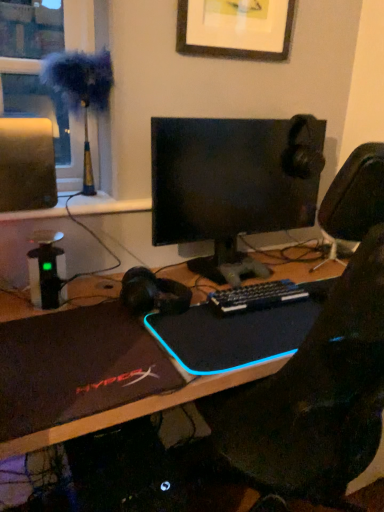
Describe the element at coordinates (118, 467) in the screenshot. I see `black matte desk at center` at that location.

Where is `wooden picture frame at upper center`? wooden picture frame at upper center is located at coordinates (236, 28).

Describe the element at coordinates (233, 184) in the screenshot. I see `black glossy monitor at center` at that location.

The width and height of the screenshot is (384, 512). What do you see at coordinates (257, 296) in the screenshot? I see `black plastic keyboard at center` at bounding box center [257, 296].

You are a GUI agent. You are given a task and a screenshot of the screen. Output one action in this format:
    pyautogui.click(x=<x>, y=<y>)
    Task: Click on the black matte desk at center
    The width and height of the screenshot is (384, 512).
    Given the screenshot: What is the action you would take?
    pyautogui.click(x=118, y=467)

Is the surface of black matte desk at center in direct contact with black plastic keyboard at center?

black matte desk at center and black plastic keyboard at center are not in contact.

Considering the relative sizes of black matte desk at center and black plastic keyboard at center in the image provided, is black matte desk at center wider than black plastic keyboard at center?

Yes.

Consider the image. Is black matte desk at center oriented away from black plastic keyboard at center?

No, black plastic keyboard at center is not at the back of black matte desk at center.

In the scene shown: Measure the distance between black matte desk at center and black plastic keyboard at center.

77.94 centimeters.

Does point (207, 1) appear closer or farther from the camera than point (291, 141)?

Clearly, point (207, 1) is closer to the camera than point (291, 141).

Which is behind, wooden picture frame at upper center or black glossy monitor at center?

wooden picture frame at upper center is more distant.

Consider the image. Is wooden picture frame at upper center facing away from black glossy monitor at center?

No, wooden picture frame at upper center is not facing away from black glossy monitor at center.

Would you say wooden picture frame at upper center is to the left or to the right of black glossy monitor at center in the picture?

Based on their positions, wooden picture frame at upper center is located to the right of black glossy monitor at center.

Is black glossy monitor at center situated inside black matte desk at center or outside?

black glossy monitor at center is not enclosed by black matte desk at center.

The width and height of the screenshot is (384, 512). In the image, there is a black matte desk at center. In order to click on computer monitor above it (from the image's perspective) in this screenshot , I will do `click(233, 184)`.

Is point (255, 169) closer or farther from the camera than point (181, 503)?

Point (255, 169) is farther from the camera than point (181, 503).

Considering the relative positions of black glossy monitor at center and black matte desk at center in the image provided, is black glossy monitor at center to the right of black matte desk at center from the viewer's perspective?

Correct, you'll find black glossy monitor at center to the right of black matte desk at center.

Considering the positions of objects black plastic keyboard at center and black matte laptop at center, arranged as the first laptop when viewed from the right, in the image provided, who is more to the left, black plastic keyboard at center or black matte laptop at center, arranged as the first laptop when viewed from the right,?

Positioned to the left is black plastic keyboard at center.

Based on the photo, considering the relative sizes of black plastic keyboard at center and black matte laptop at center, arranged as the first laptop when viewed from the right, in the image provided, is black plastic keyboard at center wider than black matte laptop at center, arranged as the first laptop when viewed from the right,?

No, black plastic keyboard at center is not wider than black matte laptop at center, arranged as the first laptop when viewed from the right.

Would you say black plastic keyboard at center is inside or outside black matte laptop at center, arranged as the first laptop when viewed from the right?

black plastic keyboard at center is enclosed within black matte laptop at center, arranged as the first laptop when viewed from the right.

Is point (287, 265) closer or farther from the camera than point (104, 359)?

Point (287, 265).

Between black matte desk at center and matte black laptop at lower left, acting as the second laptop starting from the right, which one is positioned behind?

Positioned behind is matte black laptop at lower left, acting as the second laptop starting from the right.

Is black matte desk at center bigger than matte black laptop at lower left, which appears as the first laptop when viewed from the left?

Correct, black matte desk at center is larger in size than matte black laptop at lower left, which appears as the first laptop when viewed from the left.

Looking at their sizes, would you say black matte desk at center is wider or thinner than matte black laptop at lower left, acting as the second laptop starting from the right?

black matte desk at center is wider than matte black laptop at lower left, acting as the second laptop starting from the right.

Considering the sizes of objects fuzzy fabric at left and black plastic keyboard at center in the image provided, who is thinner, fuzzy fabric at left or black plastic keyboard at center?

fuzzy fabric at left is thinner.

Between fuzzy fabric at left and black plastic keyboard at center, which one is positioned in front?

black plastic keyboard at center is in front.

Is point (28, 83) closer or farther from the camera than point (283, 287)?

Point (28, 83) appears to be farther away from the viewer than point (283, 287).

How many degrees apart are the facing directions of fuzzy fabric at left and black plastic keyboard at center?

The angle between the facing direction of fuzzy fabric at left and the facing direction of black plastic keyboard at center is 0.0025 degrees.

Considering the sizes of black matte laptop at center, arranged as the first laptop when viewed from the right, and matte black laptop at lower left, which appears as the first laptop when viewed from the left, in the image, is black matte laptop at center, arranged as the first laptop when viewed from the right, wider or thinner than matte black laptop at lower left, which appears as the first laptop when viewed from the left,?

black matte laptop at center, arranged as the first laptop when viewed from the right, is thinner than matte black laptop at lower left, which appears as the first laptop when viewed from the left.

How different are the orientations of black matte laptop at center, arranged as the first laptop when viewed from the right, and matte black laptop at lower left, which appears as the first laptop when viewed from the left, in degrees?

There is a 0.0022-degree angle between the facing directions of black matte laptop at center, arranged as the first laptop when viewed from the right, and matte black laptop at lower left, which appears as the first laptop when viewed from the left.

Which point is more forward, (153, 327) or (81, 364)?

The point (81, 364) is in front.

Where is `computer keyboard above the black matte desk at center (from a real-world perspective)`? computer keyboard above the black matte desk at center (from a real-world perspective) is located at coordinates (257, 296).

Image resolution: width=384 pixels, height=512 pixels. I want to click on computer monitor beneath the wooden picture frame at upper center (from a real-world perspective), so click(233, 184).

From the image, which object appears to be nearer to fuzzy fabric at left, black matte laptop at center, placed as the second laptop when sorted from left to right, or black glossy monitor at center?

black glossy monitor at center lies closer to fuzzy fabric at left than the other object.

Estimate the real-world distances between objects in this image. Which object is closer to black glossy monitor at center, black matte laptop at center, arranged as the first laptop when viewed from the right, or matte black laptop at lower left, acting as the second laptop starting from the right?

black matte laptop at center, arranged as the first laptop when viewed from the right, lies closer to black glossy monitor at center than the other object.

When comparing their distances from fuzzy fabric at left, does black glossy monitor at center or black matte laptop at center, arranged as the first laptop when viewed from the right, seem closer?

Among the two, black glossy monitor at center is located nearer to fuzzy fabric at left.

Looking at the image, which one is located closer to fuzzy fabric at left, black plastic keyboard at center or wooden picture frame at upper center?

wooden picture frame at upper center is closer to fuzzy fabric at left.

Based on their spatial positions, is black plastic keyboard at center or black matte desk at center further from fuzzy fabric at left?

Among the two, black matte desk at center is located further to fuzzy fabric at left.

Which object lies nearer to the anchor point black matte laptop at center, arranged as the first laptop when viewed from the right, wooden picture frame at upper center or fuzzy fabric at left?

wooden picture frame at upper center is closer to black matte laptop at center, arranged as the first laptop when viewed from the right.

Based on their spatial positions, is black glossy monitor at center or black plastic keyboard at center further from fuzzy fabric at left?

Among the two, black plastic keyboard at center is located further to fuzzy fabric at left.

Considering their positions, is black glossy monitor at center positioned closer to wooden picture frame at upper center than matte black laptop at lower left, acting as the second laptop starting from the right?

The object closer to wooden picture frame at upper center is black glossy monitor at center.

The width and height of the screenshot is (384, 512). Identify the location of computer keyboard between wooden picture frame at upper center and matte black laptop at lower left, which appears as the first laptop when viewed from the left, in the up-down direction. (257, 296).

Where is `window screen between wooden picture frame at upper center and black plastic keyboard at center in the up-down direction`? window screen between wooden picture frame at upper center and black plastic keyboard at center in the up-down direction is located at coordinates (30, 29).

You are a GUI agent. You are given a task and a screenshot of the screen. Output one action in this format:
    pyautogui.click(x=<x>, y=<y>)
    Task: Click on the computer monitor between wooden picture frame at upper center and black matte desk at center in the vertical direction
    The width and height of the screenshot is (384, 512).
    Given the screenshot: What is the action you would take?
    pyautogui.click(x=233, y=184)

Where is `desk located between fuzzy fabric at left and black matte laptop at center, arranged as the first laptop when viewed from the right, in the left-right direction`? Image resolution: width=384 pixels, height=512 pixels. desk located between fuzzy fabric at left and black matte laptop at center, arranged as the first laptop when viewed from the right, in the left-right direction is located at coordinates (118, 467).